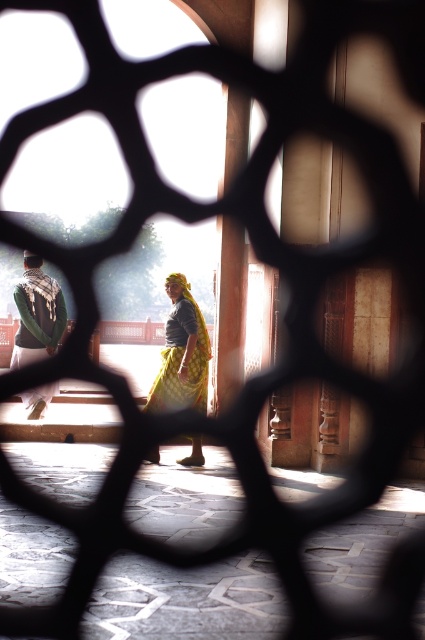
Question: Among these objects, which one is farthest from the camera?

Choices:
 (A) yellow fabric skirt at center
 (B) green fabric shawl at left

Answer: (B)

Question: Observing the image, what is the correct spatial positioning of yellow fabric skirt at center in reference to green fabric shawl at left?

Choices:
 (A) below
 (B) above

Answer: (A)

Question: Can you confirm if yellow fabric skirt at center is positioned below green fabric shawl at left?

Choices:
 (A) yes
 (B) no

Answer: (A)

Question: Can you confirm if yellow fabric skirt at center is bigger than green fabric shawl at left?

Choices:
 (A) no
 (B) yes

Answer: (B)

Question: Which point is closer to the camera taking this photo?

Choices:
 (A) (47, 276)
 (B) (178, 394)

Answer: (B)